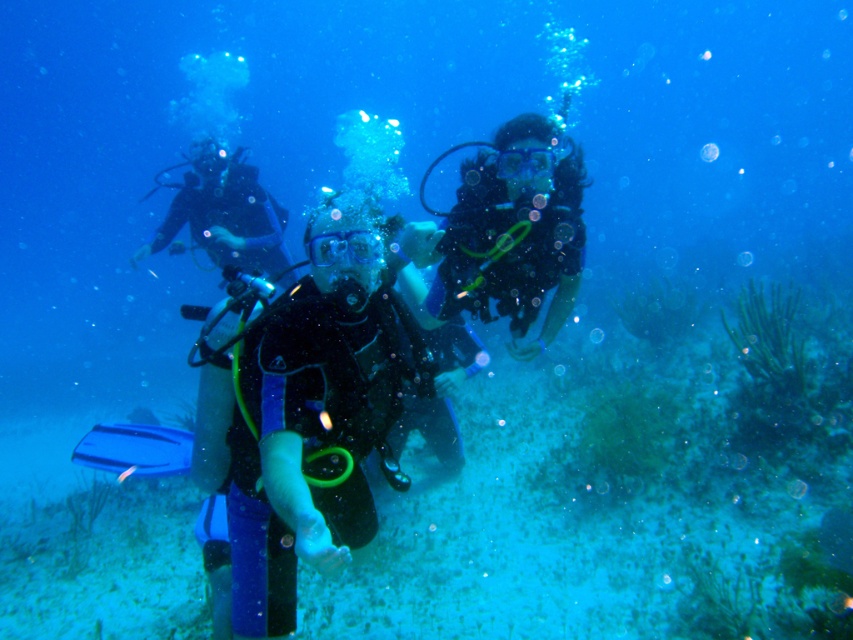
You are a marine biologist observing the underwater scene. You notice two divers labeled as black matte scuba diver at center and matte black scuba diver at center. Which diver appears closer to you based on their size?

The black matte scuba diver at center appears closer because it is larger in size than the matte black scuba diver at center, indicating proximity in the underwater scene.

You are a marine biologist planning to place a buoy at coordinates 0.648, 0.370 to mark the location of the black matte scuba diver at center. Is this placement accurate based on the image?

The position of black matte scuba diver at center is at point (315, 413), so yes, placing the buoy at those coordinates will accurately mark the location of the black matte scuba diver at center.